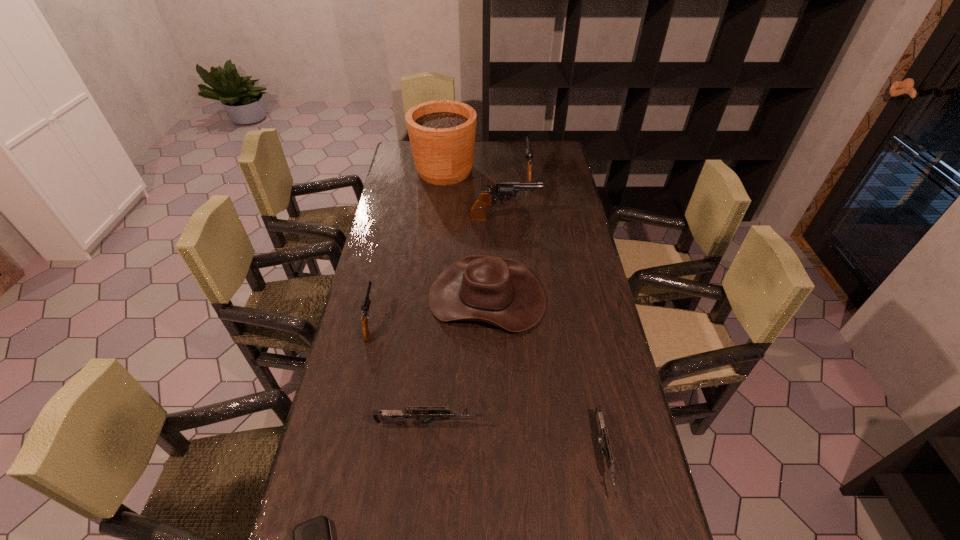
This screenshot has height=540, width=960. I want to click on the smaller grey gun, so click(x=602, y=431).

Locate an element on the screen. Image resolution: width=960 pixels, height=540 pixels. the shortest gun is located at coordinates (602, 431).

Locate an element on the screen. Image resolution: width=960 pixels, height=540 pixels. vacant region located on the front of the flowerpot is located at coordinates (439, 231).

Find the location of a particular element. The width and height of the screenshot is (960, 540). vacant space situated along the barrel of the biggest black gun is located at coordinates (563, 218).

At what (x,y) coordinates should I click in order to perform the action: click on vacant space positioned along the barrel of the farthest black gun. Please return your answer as a coordinate pair (x, y). The width and height of the screenshot is (960, 540). Looking at the image, I should click on (523, 149).

Find the location of a particular element. vacant region located along the barrel of the farthest black gun is located at coordinates (524, 153).

Identify the location of vacant space located along the barrel of the farthest black gun. The image size is (960, 540). (522, 141).

The image size is (960, 540). I want to click on vacant area situated on the back of the cowboy hat, so click(486, 242).

You are a GUI agent. You are given a task and a screenshot of the screen. Output one action in this format:
    pyautogui.click(x=<x>, y=<y>)
    Task: Click on the free space located along the barrel of the fifth tallest object
    
    Given the screenshot: What is the action you would take?
    pyautogui.click(x=392, y=230)

This screenshot has width=960, height=540. Find the location of `free space located 0.190m along the barrel of the fifth tallest object`. free space located 0.190m along the barrel of the fifth tallest object is located at coordinates (384, 262).